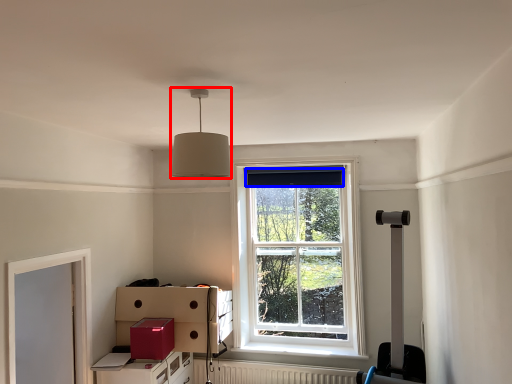
Question: Which object is closer to the camera taking this photo, lamp (highlighted by a red box) or curtain (highlighted by a blue box)?

Choices:
 (A) lamp
 (B) curtain

Answer: (A)